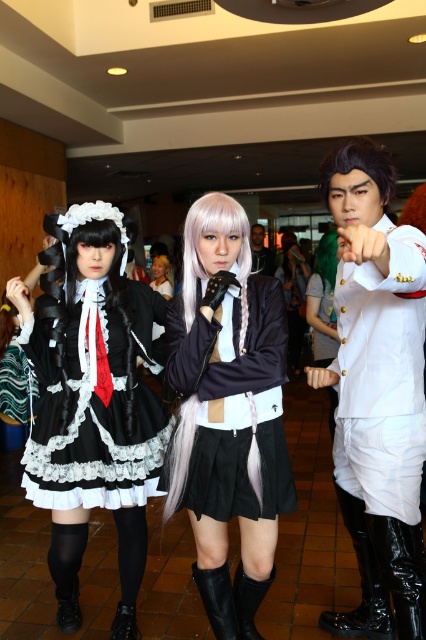
Question: Which object is positioned farthest from the smooth white shirt at center?

Choices:
 (A) matte black dress at center
 (B) black leather boot at lower center
 (C) black leather boot at lower right

Answer: (B)

Question: Can you confirm if satin black dress at center is bigger than black leather boot at lower left?

Choices:
 (A) no
 (B) yes

Answer: (B)

Question: Is the position of matte black dress at center less distant than that of black leather boot at lower left?

Choices:
 (A) yes
 (B) no

Answer: (A)

Question: Among these objects, which one is farthest from the camera?

Choices:
 (A) black leather boot at lower right
 (B) smooth white shirt at center

Answer: (B)

Question: Which of these objects is positioned farthest from the black leather boot at lower center?

Choices:
 (A) satin black dress at center
 (B) matte black dress at center
 (C) white glossy suit at center

Answer: (C)

Question: Can you confirm if satin black dress at center is bigger than glossy patent leather boot at lower right?

Choices:
 (A) yes
 (B) no

Answer: (A)